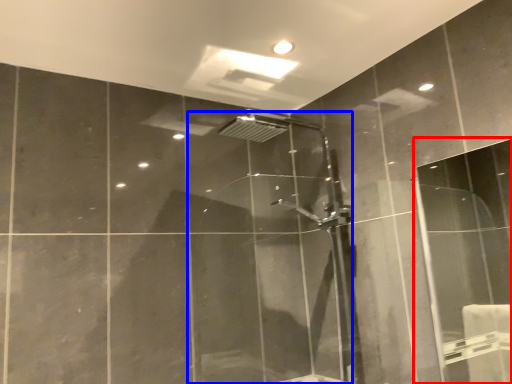
Question: Among these objects, which one is farthest to the camera, screen door (highlighted by a red box) or shower door (highlighted by a blue box)?

Choices:
 (A) screen door
 (B) shower door

Answer: (B)